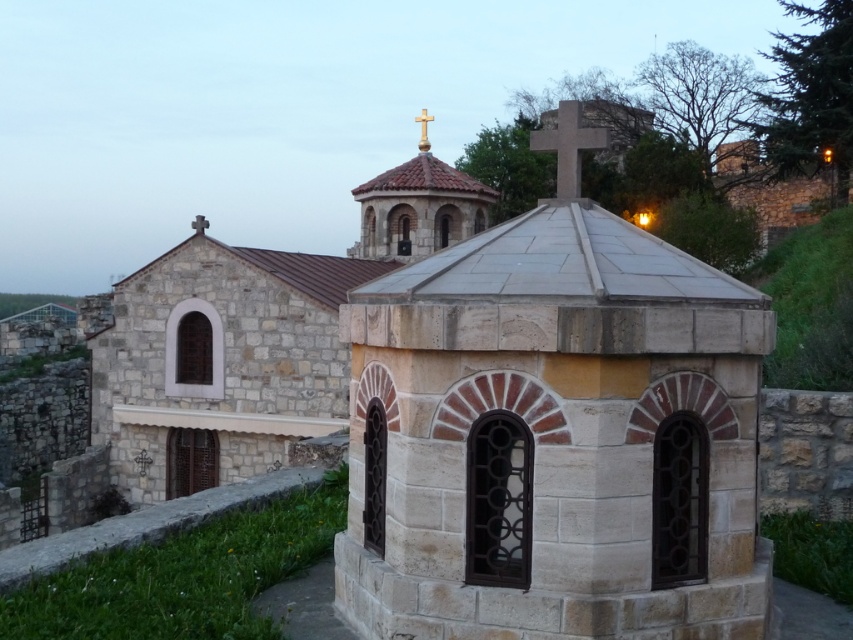
Consider the image. Does stone chapel at center have a larger size compared to wooden cross at center?

No, stone chapel at center is not bigger than wooden cross at center.

Can you confirm if stone chapel at center is positioned to the right of wooden cross at center?

Correct, you'll find stone chapel at center to the right of wooden cross at center.

Is point (367, 499) behind point (418, 141)?

No.

In order to click on stone chapel at center in this screenshot , I will do `click(554, 440)`.

Between stone chapel at center and smooth stone cross at upper center, which one appears on the left side from the viewer's perspective?

stone chapel at center is more to the left.

Is stone chapel at center taller than smooth stone cross at upper center?

Incorrect, stone chapel at center's height is not larger of smooth stone cross at upper center's.

Where is `stone chapel at center`? The width and height of the screenshot is (853, 640). stone chapel at center is located at coordinates (554, 440).

Can you confirm if smooth stone cross at upper center is smaller than wooden cross at center?

No, smooth stone cross at upper center is not smaller than wooden cross at center.

Looking at this image, is the position of smooth stone cross at upper center more distant than that of wooden cross at center?

No, it is in front of wooden cross at center.

Does point (546, 147) come behind point (427, 113)?

No, it is not.

At what (x,y) coordinates should I click in order to perform the action: click on smooth stone cross at upper center. Please return your answer as a coordinate pair (x, y). Looking at the image, I should click on (567, 145).